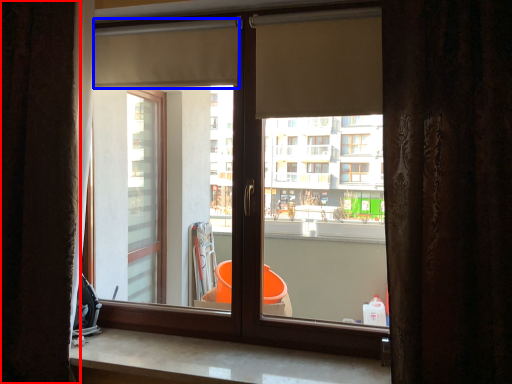
Question: Which object is further to the camera taking this photo, curtain (highlighted by a red box) or shutter (highlighted by a blue box)?

Choices:
 (A) curtain
 (B) shutter

Answer: (B)